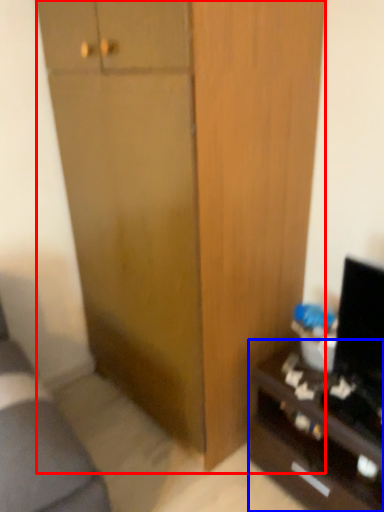
Question: Which point is further to the camera, cabinetry (highlighted by a red box) or desk (highlighted by a blue box)?

Choices:
 (A) cabinetry
 (B) desk

Answer: (B)